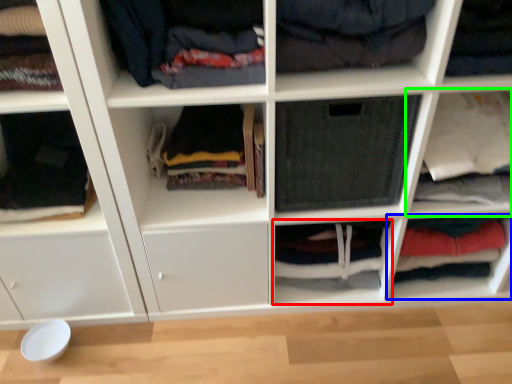
Question: Which object is the farthest from cabinet (highlighted by a red box)? Choose among these: cabinet (highlighted by a blue box) or shelf (highlighted by a green box).

Choices:
 (A) cabinet
 (B) shelf

Answer: (B)